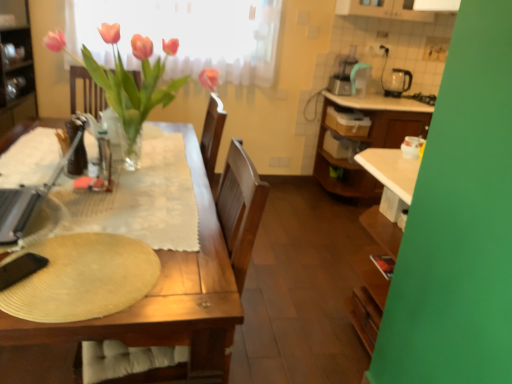
Question: Would you say translucent glass vase at center is to the left or to the right of black plastic kettle at upper right, the 2th appliance when ordered from front to back, in the picture?

Choices:
 (A) left
 (B) right

Answer: (A)

Question: Choose the correct answer: Is translucent glass vase at center inside black plastic kettle at upper right, the second appliance positioned from the left, or outside it?

Choices:
 (A) outside
 (B) inside

Answer: (A)

Question: Which object is the farthest from the translucent glass vase at center?

Choices:
 (A) translucent glass bottle at table left
 (B) black plastic kettle at upper right, which is counted as the first appliance, starting from the right
 (C) metallic silver laptop at left, the 2th appliance when ordered from back to front
 (D) beige textured paper plate at lower left

Answer: (B)

Question: Considering the real-world distances, which object is closest to the black plastic kettle at upper right, the first appliance positioned from the top?

Choices:
 (A) metallic silver laptop at left, the first appliance from the bottom
 (B) beige textured paper plate at lower left
 (C) translucent glass vase at center
 (D) translucent glass bottle at table left

Answer: (C)